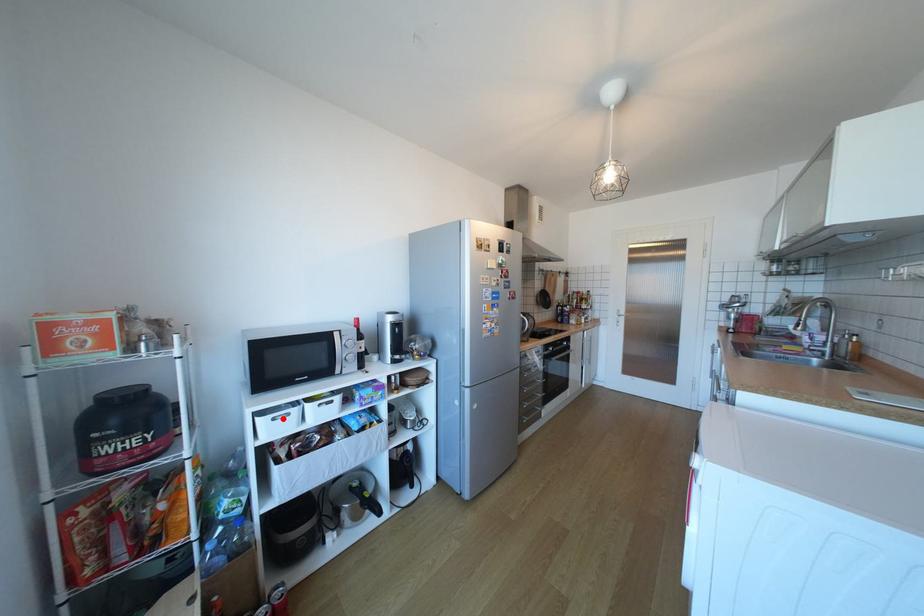
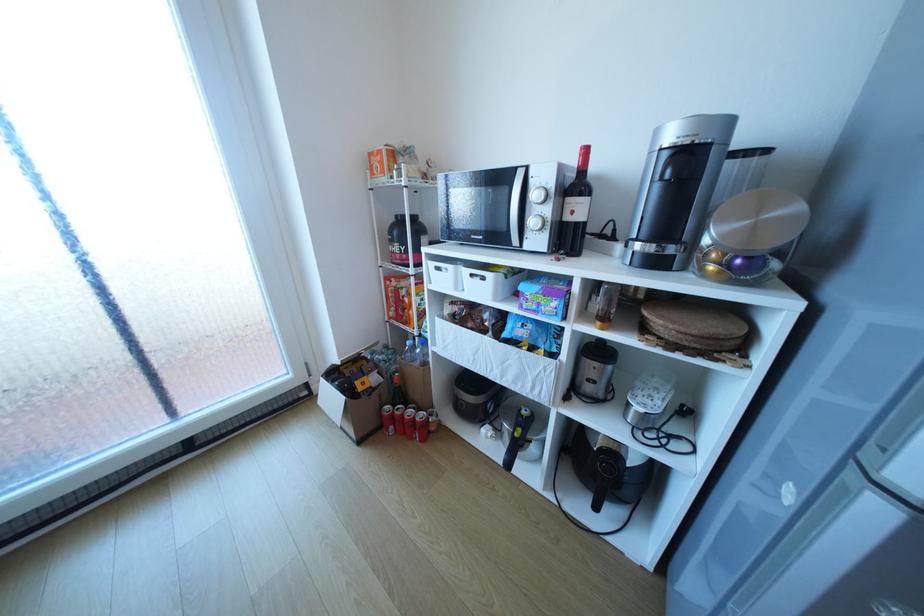
Where in the second image is the point corresponding to the highlighted location from the first image?

(446, 268)